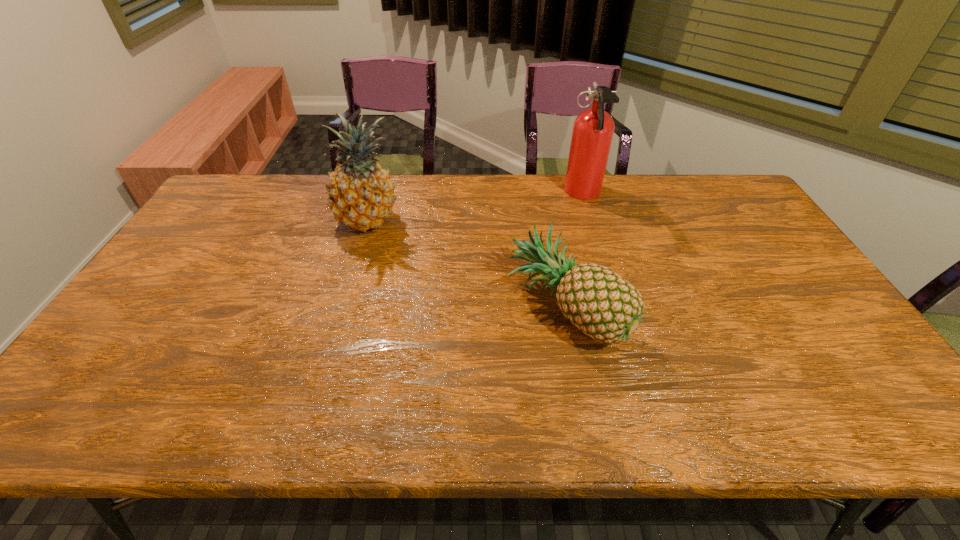
The width and height of the screenshot is (960, 540). In the image, there is a desktop. Find the location of `free space at the far edge`. free space at the far edge is located at coordinates (616, 198).

This screenshot has width=960, height=540. In the image, there is a desktop. In order to click on vacant space at the near edge in this screenshot , I will do `click(365, 400)`.

Identify the location of free space at the right edge. This screenshot has width=960, height=540. (722, 224).

The image size is (960, 540). I want to click on vacant area at the far right corner, so click(730, 179).

The width and height of the screenshot is (960, 540). Identify the location of blank region between the nearer pineapple and the fire extinguisher. (574, 251).

At what (x,y) coordinates should I click in order to perform the action: click on unoccupied position between the shorter pineapple and the fire extinguisher. Please return your answer as a coordinate pair (x, y). Looking at the image, I should click on (574, 251).

Identify the location of vacant area that lies between the taller pineapple and the fire extinguisher. (475, 207).

At what (x,y) coordinates should I click in order to perform the action: click on free space between the right pineapple and the leftmost object. Please return your answer as a coordinate pair (x, y). Image resolution: width=960 pixels, height=540 pixels. Looking at the image, I should click on (467, 265).

Image resolution: width=960 pixels, height=540 pixels. I want to click on unoccupied area between the left pineapple and the fire extinguisher, so click(x=475, y=207).

At what (x,y) coordinates should I click in order to perform the action: click on free spot between the farther pineapple and the nearest object. Please return your answer as a coordinate pair (x, y). Looking at the image, I should click on (467, 265).